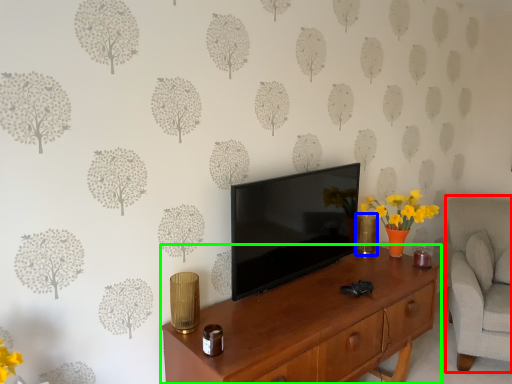
Question: Which is nearer to the swivel chair (highlighted by a red box)? vase (highlighted by a blue box) or desk (highlighted by a green box).

Choices:
 (A) vase
 (B) desk

Answer: (A)